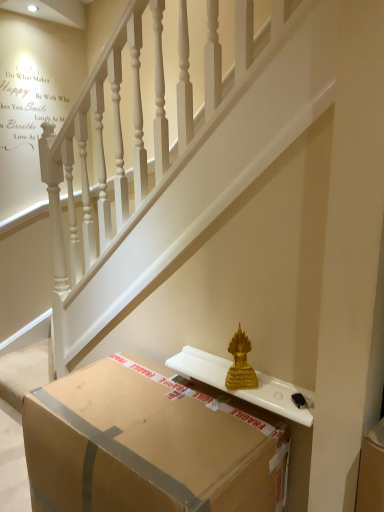
Question: From a real-world perspective, is gold statue at center above or below brown cardboard box at lower center?

Choices:
 (A) below
 (B) above

Answer: (B)

Question: Which is correct: gold statue at center is inside brown cardboard box at lower center, or outside of it?

Choices:
 (A) inside
 (B) outside

Answer: (B)

Question: Is point (286, 17) positioned closer to the camera than point (147, 379)?

Choices:
 (A) closer
 (B) farther

Answer: (A)

Question: From the image's perspective, is brown cardboard box at lower center located above or below gold statue at center?

Choices:
 (A) above
 (B) below

Answer: (B)

Question: In terms of width, does brown cardboard box at lower center look wider or thinner when compared to gold statue at center?

Choices:
 (A) wide
 (B) thin

Answer: (A)

Question: Considering the relative positions of brown cardboard box at lower center and gold statue at center in the image provided, is brown cardboard box at lower center to the left or to the right of gold statue at center?

Choices:
 (A) left
 (B) right

Answer: (A)

Question: Relative to gold statue at center, is brown cardboard box at lower center in front or behind?

Choices:
 (A) front
 (B) behind

Answer: (A)